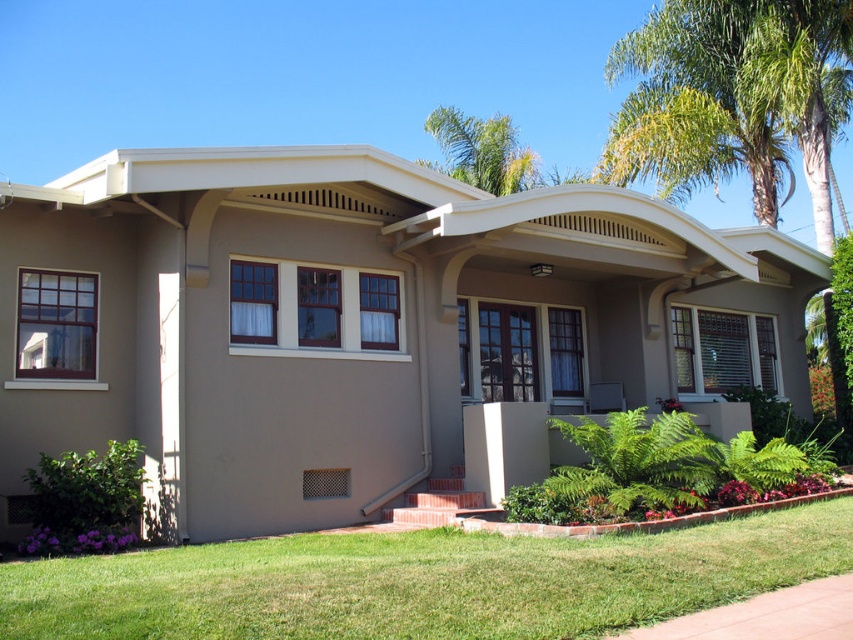
Can you confirm if green grass at lower center is positioned above green leafy palm tree at upper center?

Actually, green grass at lower center is below green leafy palm tree at upper center.

Who is lower down, green grass at lower center or green leafy palm tree at upper center?

green grass at lower center is lower down.

Describe the element at coordinates (422, 580) in the screenshot. This screenshot has height=640, width=853. I see `green grass at lower center` at that location.

Locate an element on the screen. The image size is (853, 640). green grass at lower center is located at coordinates (422, 580).

Does green leafy palm tree at upper right have a lesser width compared to green leafy palm tree at upper center?

No.

Measure the distance between point (807, 36) and camera.

The distance of point (807, 36) from camera is 59.70 feet.

This screenshot has height=640, width=853. In order to click on green leafy palm tree at upper right in this screenshot , I will do `click(728, 97)`.

Does green grass at lower center appear over green leafy palm tree at upper right?

No, green grass at lower center is not above green leafy palm tree at upper right.

Can you confirm if green grass at lower center is thinner than green leafy palm tree at upper right?

No.

Between point (323, 577) and point (701, 102), which one is positioned behind?

Point (701, 102)

The image size is (853, 640). Identify the location of green grass at lower center. (422, 580).